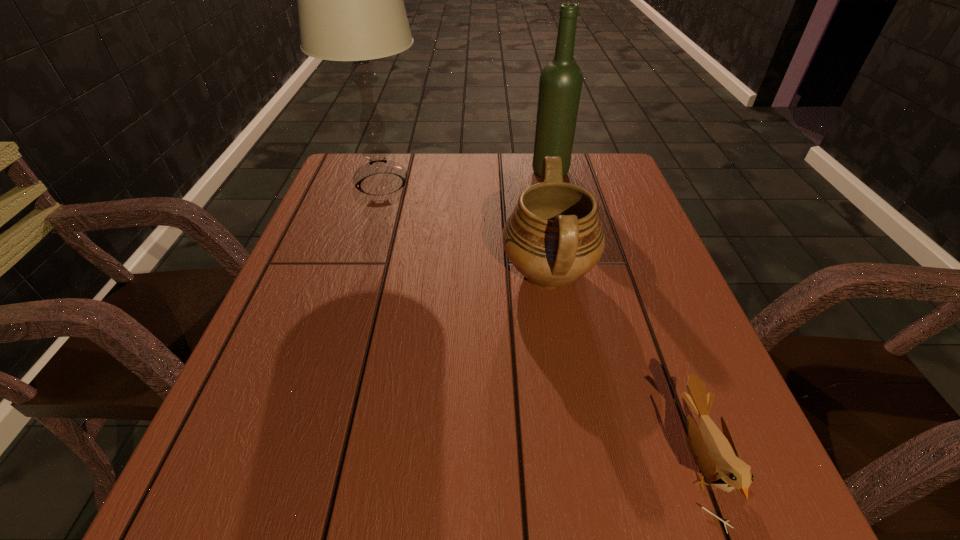
Identify the location of the leftmost object. Image resolution: width=960 pixels, height=540 pixels. (350, 3).

Locate an element on the screen. This screenshot has height=540, width=960. table lamp is located at coordinates (350, 3).

You are a GUI agent. You are given a task and a screenshot of the screen. Output one action in this format:
    pyautogui.click(x=<x>, y=<y>)
    Task: Click on the second tallest object
    This screenshot has height=540, width=960.
    Given the screenshot: What is the action you would take?
    pyautogui.click(x=560, y=84)

The image size is (960, 540). Identify the location of the second nearest object. (553, 237).

Identify the location of the third tallest object. The image size is (960, 540). (553, 237).

At what (x,y) coordinates should I click in order to perform the action: click on bird. Please return your answer as a coordinate pair (x, y). This screenshot has width=960, height=540. Looking at the image, I should click on (715, 454).

Where is `the shortest object`? the shortest object is located at coordinates (715, 454).

Locate an element on the screen. The image size is (960, 540). vacant space located on the front-facing side of the tallest object is located at coordinates (555, 184).

Find the location of a particular element. The image size is (960, 540). vacant area located 0.160m on the front of the wine bottle is located at coordinates (561, 217).

Where is `free spot located 0.160m on the front-facing side of the urn`? The image size is (960, 540). free spot located 0.160m on the front-facing side of the urn is located at coordinates (425, 274).